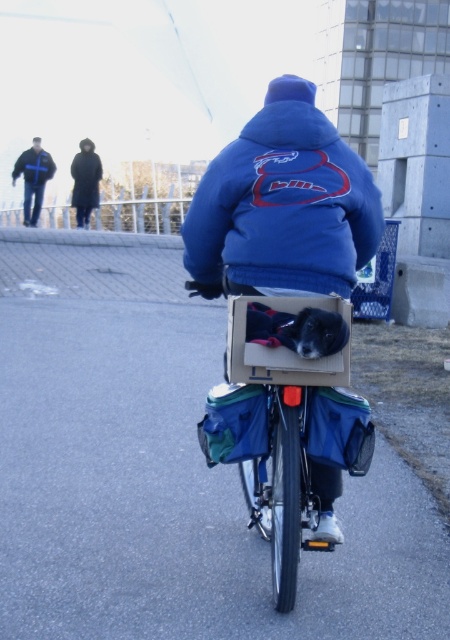
You are a delivery person who needs to deliver a package to a recipient wearing a black matte jacket at upper left. You are currently wearing a blue fleece jacket at center. If the delivery area is 50 feet in radius, will you be able to reach the recipient without exceeding the delivery radius?

The distance between the blue fleece jacket at center and the black matte jacket at upper left is 54.23 feet, which exceeds the 50 feet delivery radius. Therefore, you cannot reach the recipient within the allowed distance.

You are standing at the starting point and see two points marked on the path ahead. The first point is at coordinate point(x=292, y=173) and the second point is at coordinate point(x=23, y=212). Which point is closer to you?

Point(x=292, y=173) is in front of point(x=23, y=212), so it is closer to you.